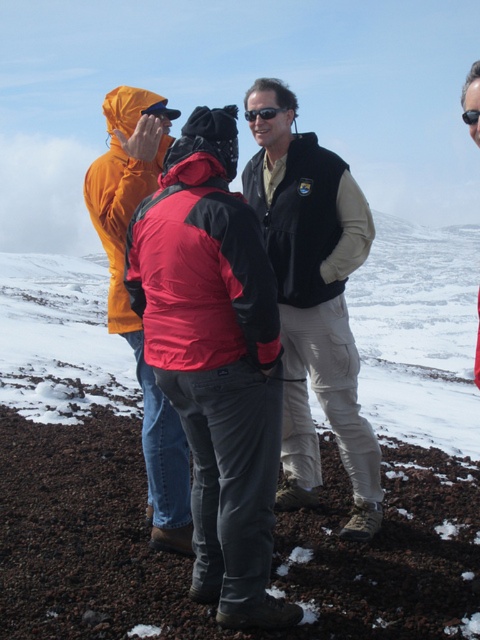
You are a photographer trying to capture a clear shot of both the velvet black vest at center and the black plastic goggles at upper right. Which object should you focus on first if you want to ensure both are in focus without moving the camera?

The velvet black vest at center is positioned under the black plastic goggles at upper right. To ensure both are in focus, focus on the velvet black vest at center first since it is closer to the camera. This way, the depth of field will extend to the goggles above it.

You are a photographer planning to capture a landscape shot of the white fluffy cloud at upper left and the black plastic goggles at upper right. Which object should you pan your camera to the right to focus on?

The black plastic goggles at upper right are to the right of the white fluffy cloud at upper left, so you should pan your camera to the right to focus on the black plastic goggles at upper right.

Consider the image. You are planning to place a small flag on the white powdery snow at center. However, you need to ensure that the flag is visible from the black plastic goggles at upper right. Based on their positions, will the flag be visible from that vantage point?

The white powdery snow at center is positioned on the left side of black plastic goggles at upper right. Since the flag is placed on the snow, it would be visible from the goggles as they are positioned to the right of the snow area.